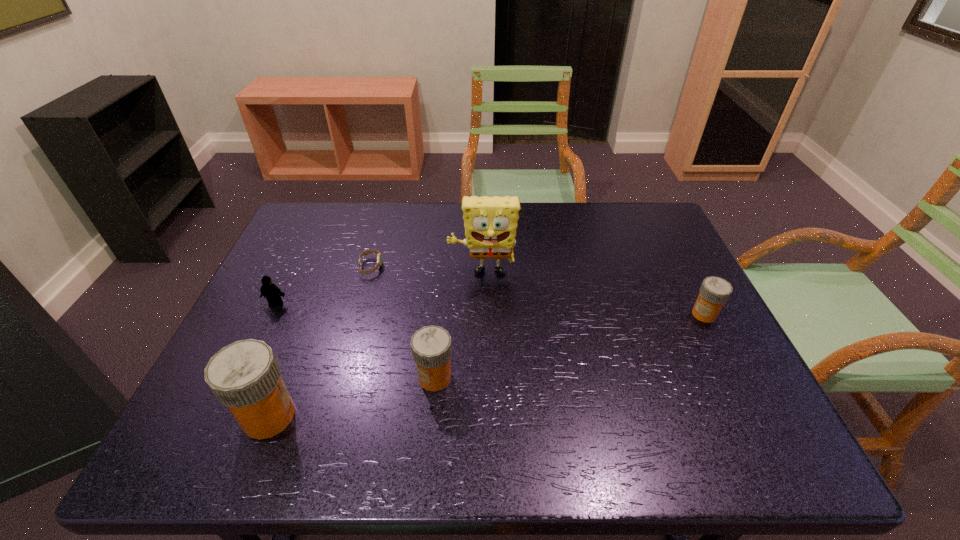
Locate an element on the screen. This screenshot has width=960, height=540. vacant region between the leftmost object and the second tallest medicine is located at coordinates (355, 341).

This screenshot has height=540, width=960. I want to click on vacant region between the second shortest medicine and the watch, so click(402, 322).

This screenshot has height=540, width=960. Identify the location of vacant area that lies between the rightmost object and the third object from left to right. click(538, 291).

Where is `vacant point located between the watch and the tallest medicine`? vacant point located between the watch and the tallest medicine is located at coordinates (320, 341).

Locate an element on the screen. vacant space that is in between the leftmost object and the tallest object is located at coordinates (379, 289).

The width and height of the screenshot is (960, 540). Identify the location of vacant space in between the farthest medicine and the fourth object from right to left. (538, 291).

Where is `vacant area that lies between the third object from left to right and the sponge`? This screenshot has width=960, height=540. vacant area that lies between the third object from left to right and the sponge is located at coordinates (426, 271).

This screenshot has width=960, height=540. I want to click on free spot between the sponge and the fourth shortest object, so click(459, 326).

Identify the location of free area in between the shortest medicine and the shortest object. This screenshot has height=540, width=960. (538, 291).

Identify the location of the closest object to the leftmost object. The image size is (960, 540). (379, 258).